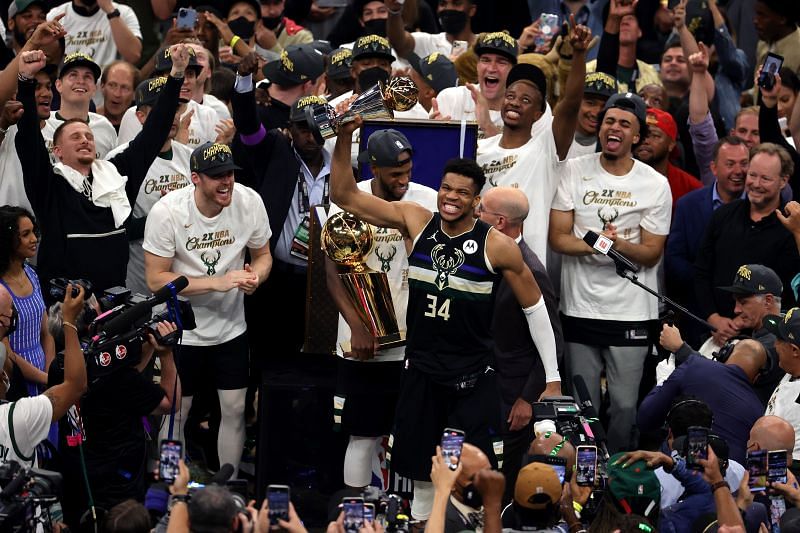
Locate an element on the screen. The width and height of the screenshot is (800, 533). phones is located at coordinates (454, 435), (358, 508), (580, 463), (686, 439), (774, 457), (164, 449).